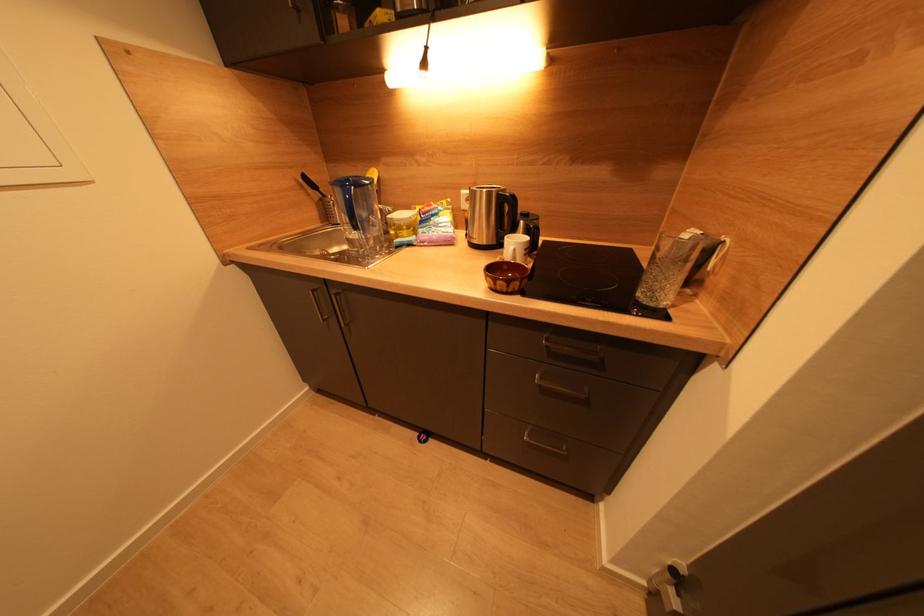
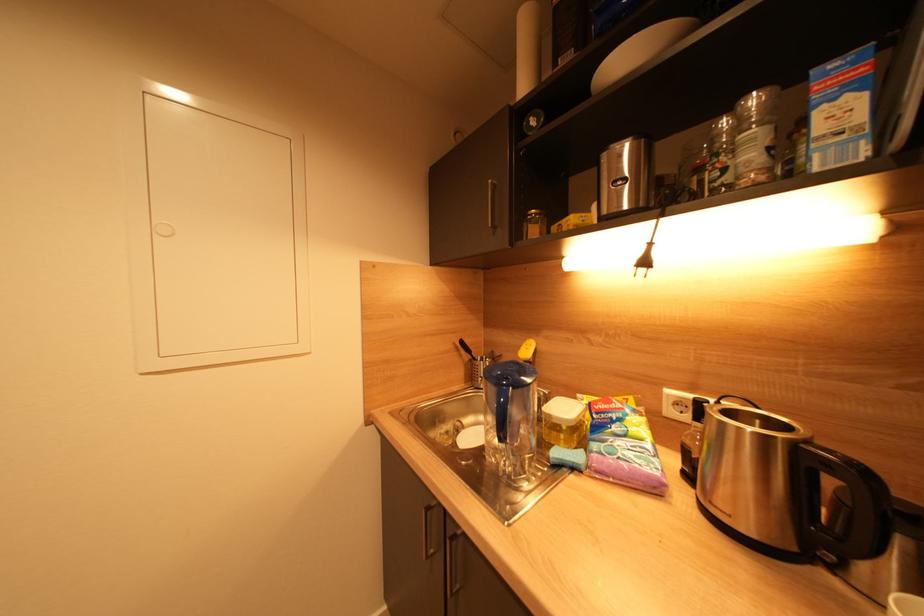
The images are taken continuously from a first-person perspective. In which direction is your viewpoint rotating?

The rotation direction of the camera is left-up.